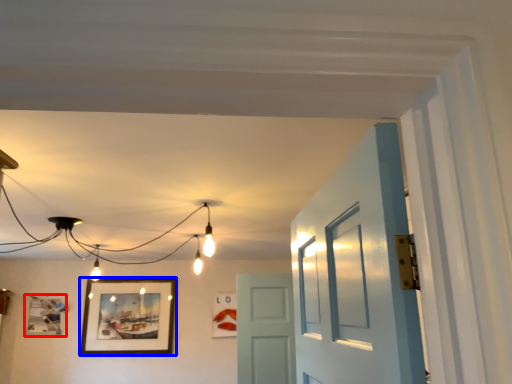
Question: Among these objects, which one is nearest to the camera, picture frame (highlighted by a red box) or picture frame (highlighted by a blue box)?

Choices:
 (A) picture frame
 (B) picture frame

Answer: (A)